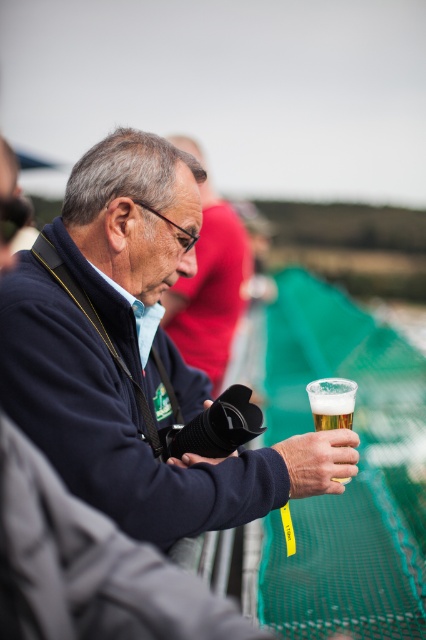
You are a photographer at the event and need to position your matte black camera at center so that it doesn not get blocked by the matte black jacket at center. Based on their positions, which direction should you move the camera?

The matte black jacket at center is to the right of the matte black camera at center. To avoid blocking, move the matte black camera at center to the left.

You are organizing a photo shoot and need to ensure that the matte black jacket at center and the translucent glass at center are both visible in the frame. Given their sizes, which object should you prioritize positioning closer to the camera to maintain clarity?

The matte black jacket at center is wider than the translucent glass at center, so you should prioritize positioning the matte black jacket at center closer to the camera to ensure its details are clear and visible.

You are standing at the center of the scene and want to move towards the closer point between point (x=104, y=448) and point (x=232, y=332). Which point should you walk towards?

You should walk towards point (x=104, y=448) because it is closer to the viewer than point (x=232, y=332).